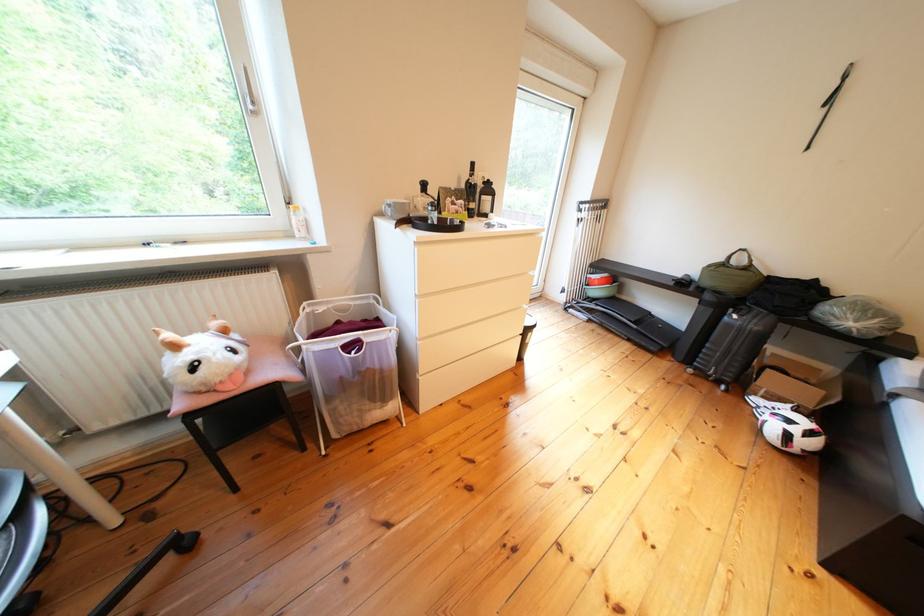
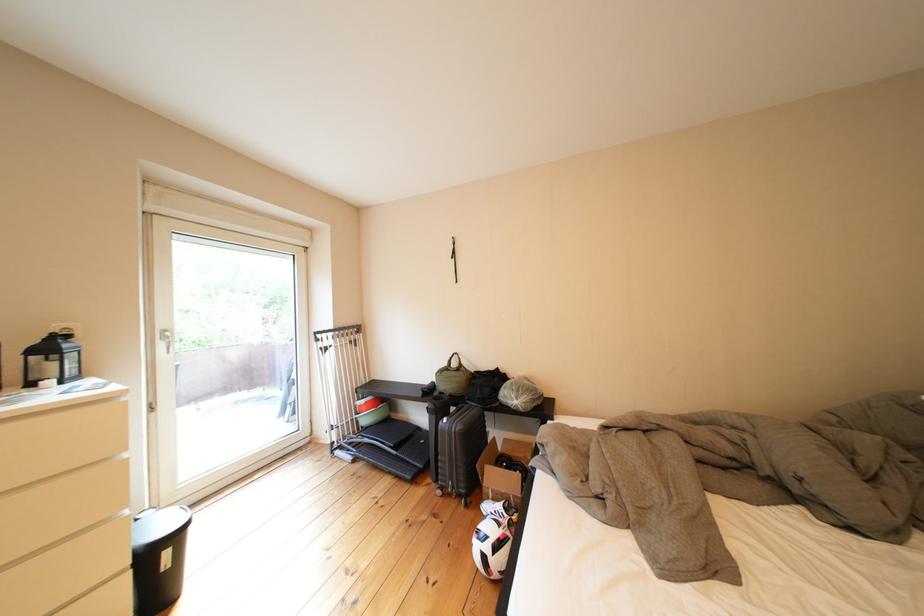
The point at (543,339) is marked in the first image. Where is the corresponding point in the second image?

(179, 557)